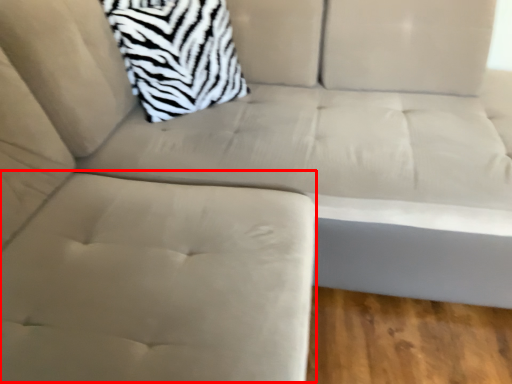
Question: From the image's perspective, where is swivel chair (annotated by the red box) located relative to throw pillow?

Choices:
 (A) above
 (B) below

Answer: (B)